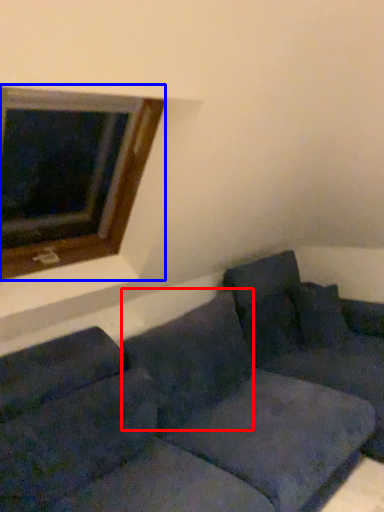
Question: Which object is closer to the camera taking this photo, pillow (highlighted by a red box) or window (highlighted by a blue box)?

Choices:
 (A) pillow
 (B) window

Answer: (B)